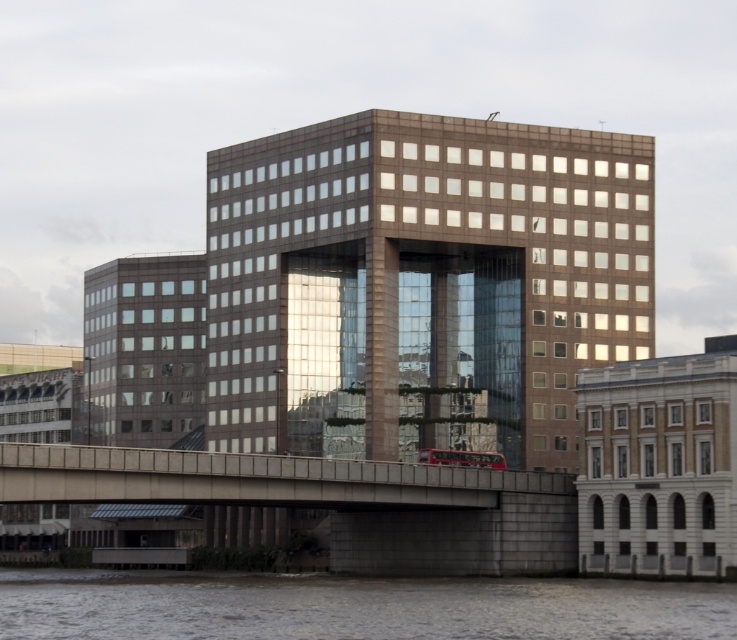
Question: Which of the following is the farthest from the observer?

Choices:
 (A) (83, 570)
 (B) (430, 406)
 (C) (298, 468)

Answer: (A)

Question: Which point appears farthest from the camera in this image?

Choices:
 (A) (63, 577)
 (B) (312, 282)

Answer: (B)

Question: Does brown glass building at center appear on the left side of brown water at lower center?

Choices:
 (A) yes
 (B) no

Answer: (B)

Question: Does brown water at lower center have a lesser width compared to concrete bridge at center?

Choices:
 (A) no
 (B) yes

Answer: (A)

Question: Can you confirm if brown glass building at center is smaller than concrete bridge at center?

Choices:
 (A) no
 (B) yes

Answer: (A)

Question: Which of the following is the closest to the observer?

Choices:
 (A) concrete bridge at center
 (B) brown water at lower center

Answer: (B)